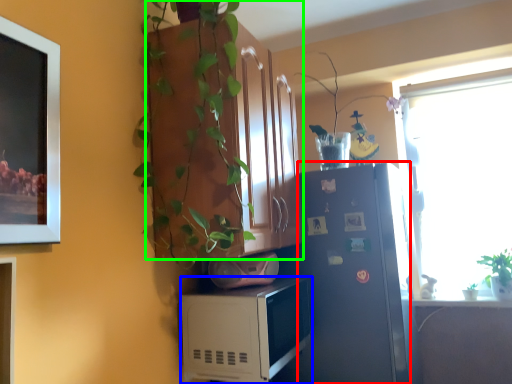
Question: Which object is positioned closest to refrigerator (highlighted by a red box)? Select from microwave oven (highlighted by a blue box) and cabinetry (highlighted by a green box).

Choices:
 (A) microwave oven
 (B) cabinetry

Answer: (A)